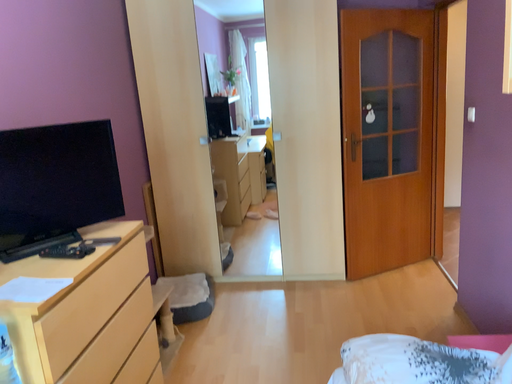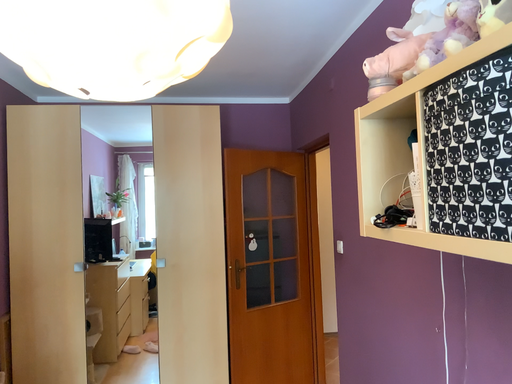
Question: Which way did the camera rotate in the video?

Choices:
 (A) rotated right
 (B) rotated left

Answer: (A)